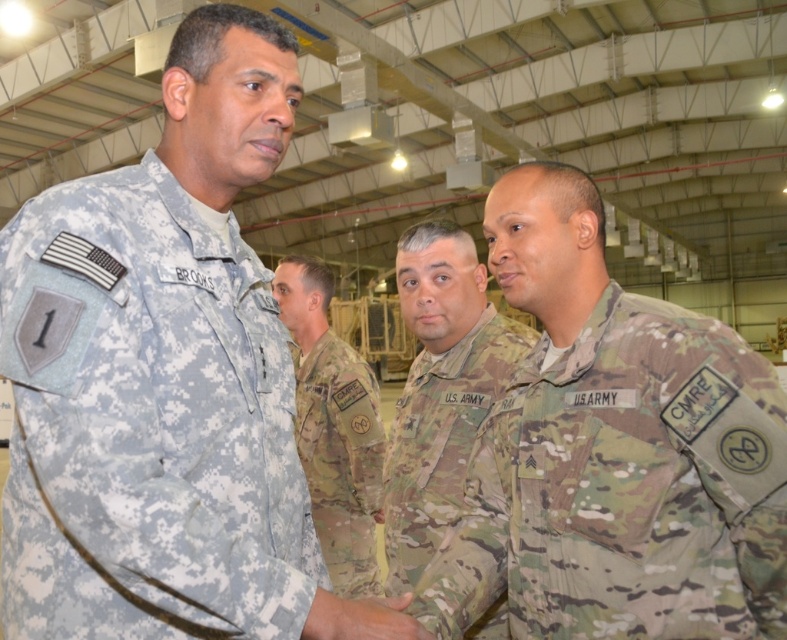
Based on the photo, you are a photographer standing at the entrance of the hangar. You want to take a group photo of the camouflage uniform at center and the multicam uniform at center. What is the minimum distance you need to step back to ensure both subjects are fully in frame?

The minimum distance you need to step back is 14.53 inches to ensure both the camouflage uniform at center and the multicam uniform at center are fully in frame.

You are a photographer standing in the hangar and need to capture a photo that clearly shows both the camouflage uniform at center and the camouflage fabric uniform at center. Which one should you focus on first to ensure it appears larger in the photo?

The camouflage fabric uniform at center should be focused on first because it is larger than the camouflage uniform at center, ensuring it will appear larger in the photo.